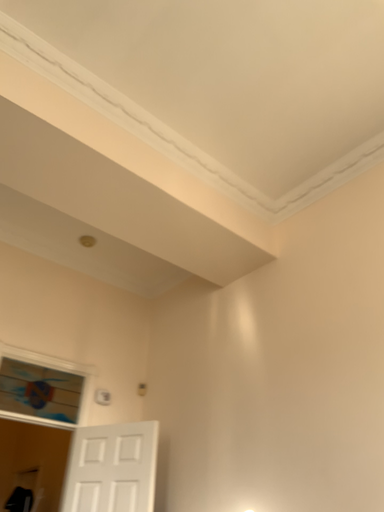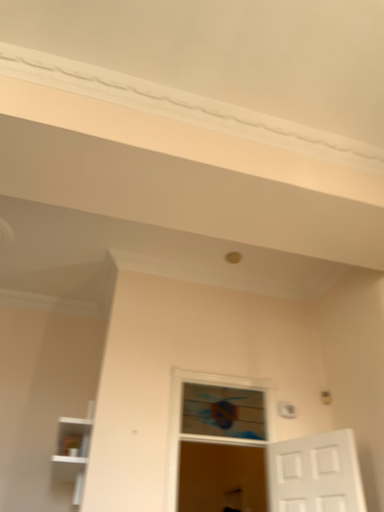
Question: Which way did the camera rotate in the video?

Choices:
 (A) rotated right
 (B) rotated left

Answer: (B)